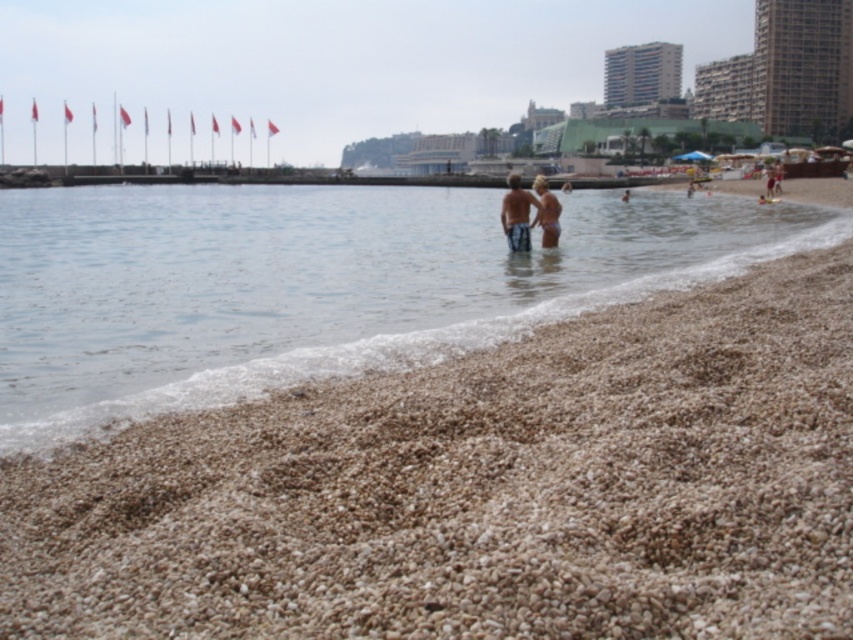
Is point (256, 609) positioned before point (531, 188)?

Yes, point (256, 609) is closer to viewer.

Is point (74, 262) positioned behind point (558, 232)?

No, (74, 262) is closer to viewer.

Who is more forward, [123,202] or [544,221]?

Positioned in front is point [544,221].

At what (x,y) coordinates should I click in order to perform the action: click on brown gravel at lower center. Please return your answer as a coordinate pair (x, y). Looking at the image, I should click on 421,417.

Between matte skin couple at center and light brown bikini at center, which one has less height?

Standing shorter between the two is matte skin couple at center.

Is matte skin couple at center positioned at the back of light brown bikini at center?

Yes, matte skin couple at center is further from the viewer.

Between point (556, 237) and point (547, 225), which one is positioned behind?

Positioned behind is point (556, 237).

At what (x,y) coordinates should I click in order to perform the action: click on matte skin couple at center. Please return your answer as a coordinate pair (x, y). This screenshot has width=853, height=640. Looking at the image, I should click on (527, 212).

Between brown gravel at lower center and matte skin couple at center, which one appears on the left side from the viewer's perspective?

brown gravel at lower center

Based on the photo, who is more forward, (780, 408) or (532, 188)?

Positioned in front is point (780, 408).

In order to click on brown gravel at lower center in this screenshot , I will do `click(421, 417)`.